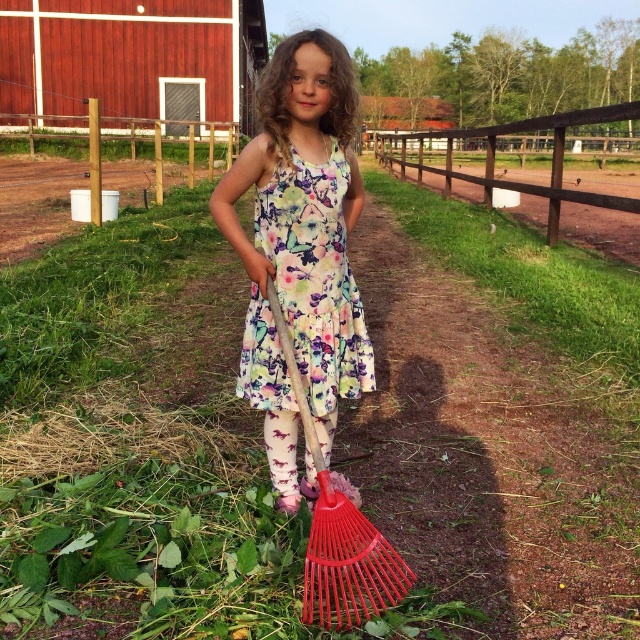
Question: Which object is closer to the camera taking this photo?

Choices:
 (A) floral cotton dress at center
 (B) floral fabric dress at center
 (C) brown wooden fence at upper center
 (D) wooden handle rake at center

Answer: (D)

Question: Is floral fabric dress at center below floral cotton dress at center?

Choices:
 (A) yes
 (B) no

Answer: (A)

Question: Can you confirm if floral cotton dress at center is positioned to the left of wooden handle rake at center?

Choices:
 (A) no
 (B) yes

Answer: (B)

Question: Does floral cotton dress at center appear over wooden handle rake at center?

Choices:
 (A) yes
 (B) no

Answer: (A)

Question: Which object is farther from the camera taking this photo?

Choices:
 (A) wooden handle rake at center
 (B) floral cotton dress at center

Answer: (B)

Question: Which point is farther from the camera taking this photo?

Choices:
 (A) (330, 621)
 (B) (314, 355)
 (C) (560, 132)
 (D) (317, 406)

Answer: (C)